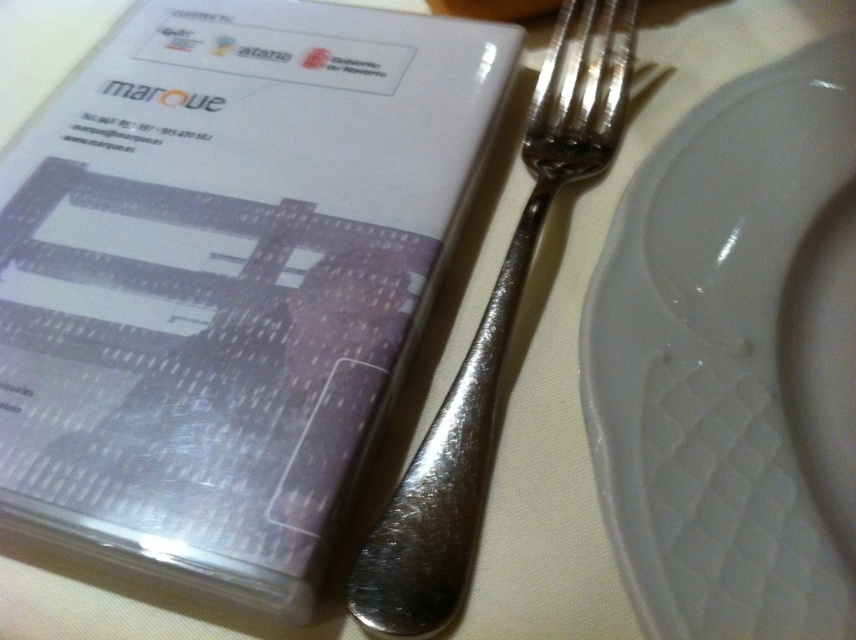
From the picture: Does white glossy platter at center appear under polished silver fork at center?

Indeed, white glossy platter at center is positioned under polished silver fork at center.

Is white glossy platter at center behind polished silver fork at center?

No, it is in front of polished silver fork at center.

Image resolution: width=856 pixels, height=640 pixels. Describe the element at coordinates (734, 362) in the screenshot. I see `white glossy platter at center` at that location.

Locate an element on the screen. This screenshot has height=640, width=856. white glossy platter at center is located at coordinates (734, 362).